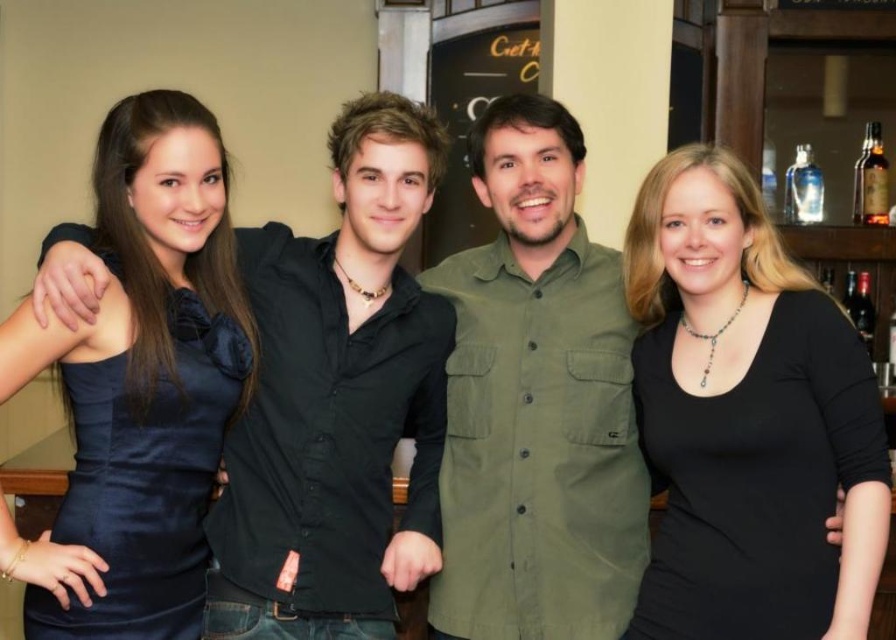
Question: Which point is farther from the camera taking this photo?

Choices:
 (A) (484, 150)
 (B) (885, 209)
 (C) (1, 541)

Answer: (B)

Question: Which of these objects is positioned closest to the satin blue dress at left?

Choices:
 (A) transparent glass bottle at upper right
 (B) black matte shirt at center
 (C) brown glass bottle at upper right
 (D) green matte shirt at center

Answer: (D)

Question: From the image, what is the correct spatial relationship of brown glass bottle at upper right in relation to transparent glass bottle at upper right?

Choices:
 (A) left
 (B) right

Answer: (B)

Question: Does green matte shirt at center appear under transparent glass bottle at upper right?

Choices:
 (A) no
 (B) yes

Answer: (B)

Question: Does black matte shirt at center have a smaller size compared to brown glass bottle at upper right?

Choices:
 (A) yes
 (B) no

Answer: (B)

Question: Which point is closer to the camera?

Choices:
 (A) black matte shirt at center
 (B) satin blue dress at left
 (C) brown glass bottle at upper right

Answer: (B)